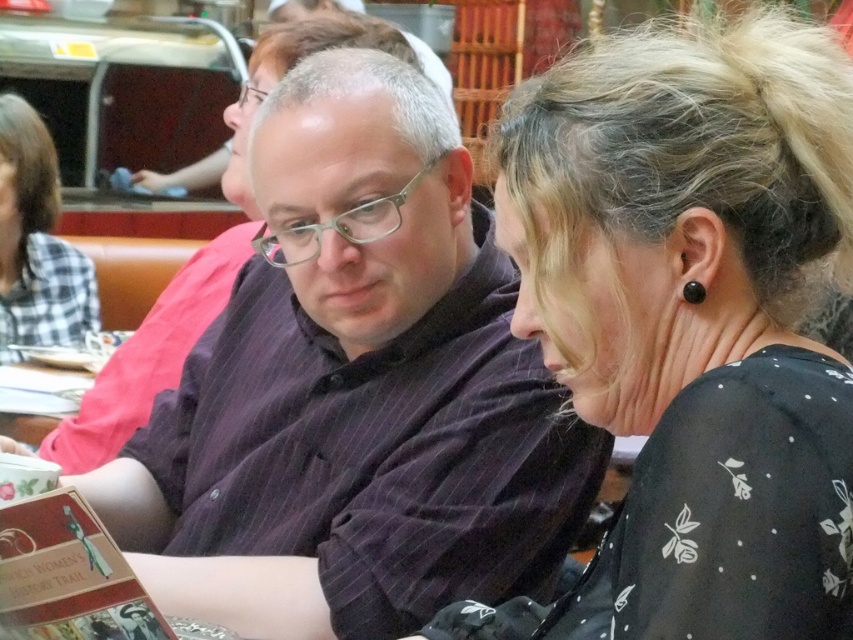
You are a photographer trying to capture a photo of the dark pinstriped shirt at center and the black dotted blouse at center. Since you want both subjects to be in focus, you need to know which one is taller. Can you determine which is taller?

The dark pinstriped shirt at center is taller than the black dotted blouse at center, so you should adjust your camera settings to ensure the taller dark pinstriped shirt at center is in focus first.

You are a delivery person who needs to hand a package to the man in the dark pinstriped shirt at center. You are currently standing 2 meters away from him. Can you reach him without moving closer?

The man in the dark pinstriped shirt at center is 1.49 meters away from you, so yes, you can reach him without moving closer since you are already within the 2 meters distance.